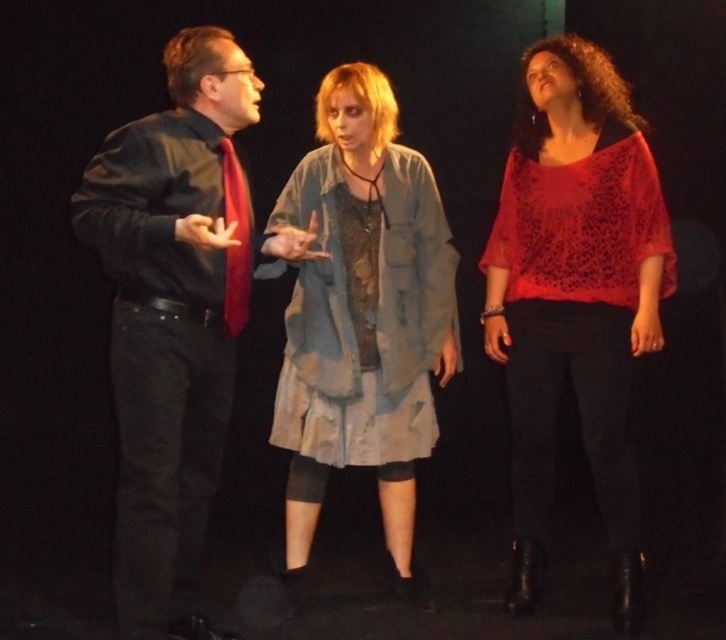
You are an event planner setting up a photo shoot for a fashion show. You need to place a backdrop that will cover the area from the left edge of the scene to the knitted red blouse at right. What is the horizontal coordinate of the rightmost point where the backdrop should end?

The knitted red blouse at right is positioned at point 0.461 on the horizontal axis, so the backdrop should end at 0.461 to cover up to that point.

You are an event planner arranging a photoshoot and need to ensure that the knitted red blouse at right and the distressed denim jacket at center are visible in the final image. Based on their positions, which jacket is more likely to be fully visible?

The knitted red blouse at right is positioned over the distressed denim jacket at center, so the knitted red blouse at right is more likely to be fully visible.